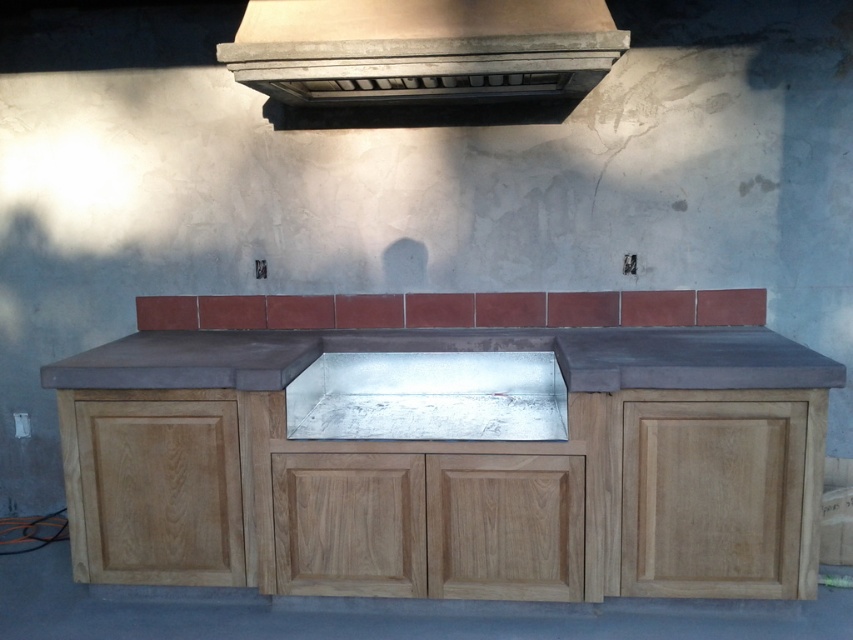
You are a kitchen designer planning to install a new vent hood over the sink. The existing concrete textured vent at upper center is currently above the silver metallic sink at center. Based on their sizes, which one would be more suitable for a standard ventilation system?

The concrete textured vent at upper center is larger in size than the silver metallic sink at center, making it more suitable for a standard ventilation system as it can provide better airflow coverage over the sink.

You are standing in the kitchen and want to reach the concrete textured vent at upper center to clean it. If your arm can extend 3 feet, can you reach it without moving closer?

The concrete textured vent at upper center is 9.03 feet away from the viewer. Since your arm can only extend 3 feet, you cannot reach it without moving closer.